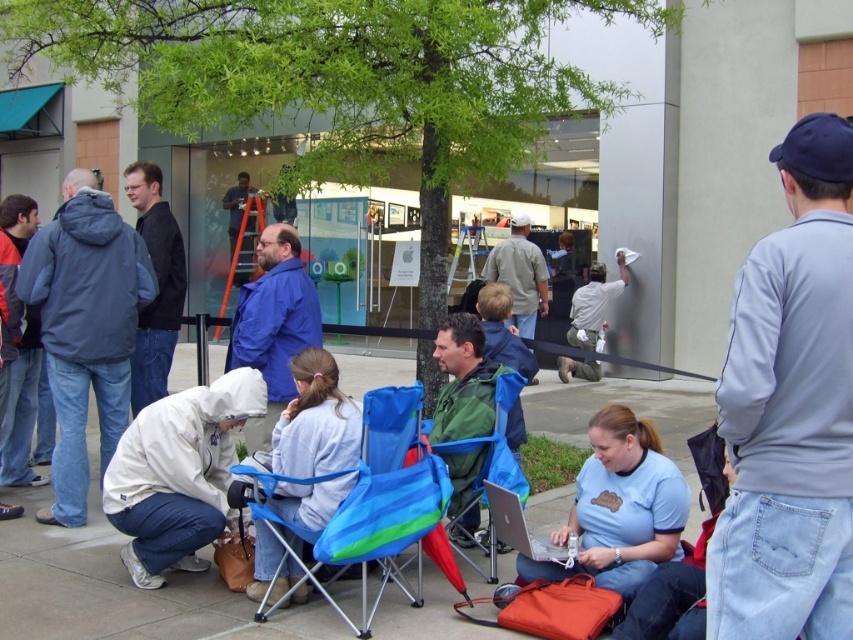
You are standing at the origin point of the coordinate system. You want to move to the blue fabric chair at center. What direction should you move in to reach it?

The blue fabric chair at center is located at coordinate point (372, 496), so you should move towards the right and slightly upwards to reach it.

You are a photographer trying to capture a clear shot of the gray cotton shirt at center from above. The blue fabric chair at center is in the way. Can you adjust your position to take the photo without moving the chair?

The blue fabric chair at center has a lesser height compared to gray cotton shirt at center, so you can lower your camera position to take the photo without obstruction from the blue fabric chair at center.

You are standing in front of the Apple Store and want to place a small item on the clear plastic laptop at center without disturbing the blue matte jacket at center. Is this possible?

The blue matte jacket at center is located above the clear plastic laptop at center, so placing an item on the laptop might require moving the jacket first to avoid disturbing it.